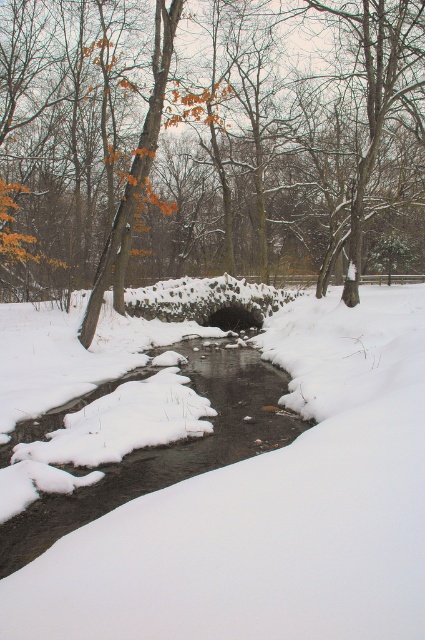
Is brown textured rock at center bigger than clear water at center?

Indeed, brown textured rock at center has a larger size compared to clear water at center.

How much distance is there between brown textured rock at center and clear water at center?

A distance of 17.05 meters exists between brown textured rock at center and clear water at center.

The image size is (425, 640). What do you see at coordinates (206, 145) in the screenshot? I see `brown textured rock at center` at bounding box center [206, 145].

Where is `brown textured rock at center`? brown textured rock at center is located at coordinates (206, 145).